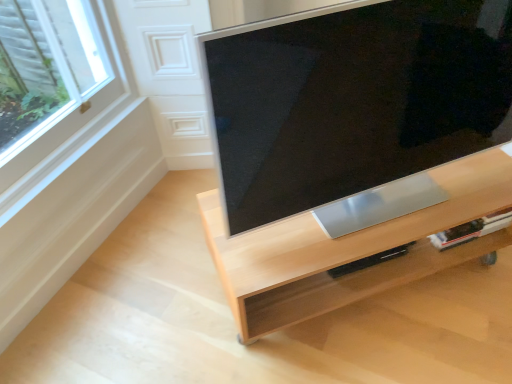
Question: From the image's perspective, relative to satin silver tv at center, is light wood tv stand at center above or below?

Choices:
 (A) below
 (B) above

Answer: (A)

Question: Is light wood tv stand at center spatially inside satin silver tv at center, or outside of it?

Choices:
 (A) inside
 (B) outside

Answer: (B)

Question: Relative to satin silver tv at center, is light wood tv stand at center in front or behind?

Choices:
 (A) front
 (B) behind

Answer: (B)

Question: Would you say satin silver tv at center is inside or outside light wood tv stand at center?

Choices:
 (A) inside
 (B) outside

Answer: (B)

Question: Is point (256, 54) positioned closer to the camera than point (461, 244)?

Choices:
 (A) farther
 (B) closer

Answer: (B)

Question: Looking at their shapes, would you say satin silver tv at center is wider or thinner than light wood tv stand at center?

Choices:
 (A) wide
 (B) thin

Answer: (B)

Question: Considering the positions of satin silver tv at center and light wood tv stand at center in the image, is satin silver tv at center taller or shorter than light wood tv stand at center?

Choices:
 (A) short
 (B) tall

Answer: (B)